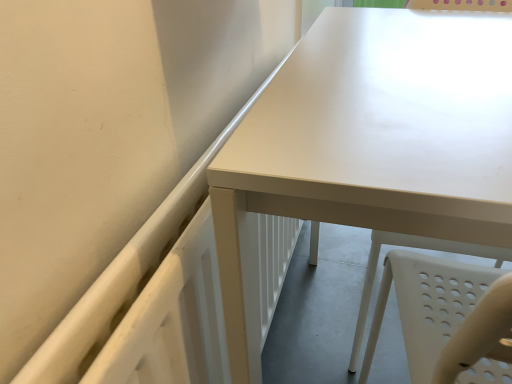
What do you see at coordinates (122, 274) in the screenshot? I see `white plastic radiator at lower left` at bounding box center [122, 274].

Image resolution: width=512 pixels, height=384 pixels. Identify the location of white plastic radiator at lower left. (122, 274).

Locate an element on the screen. white plastic radiator at lower left is located at coordinates (122, 274).